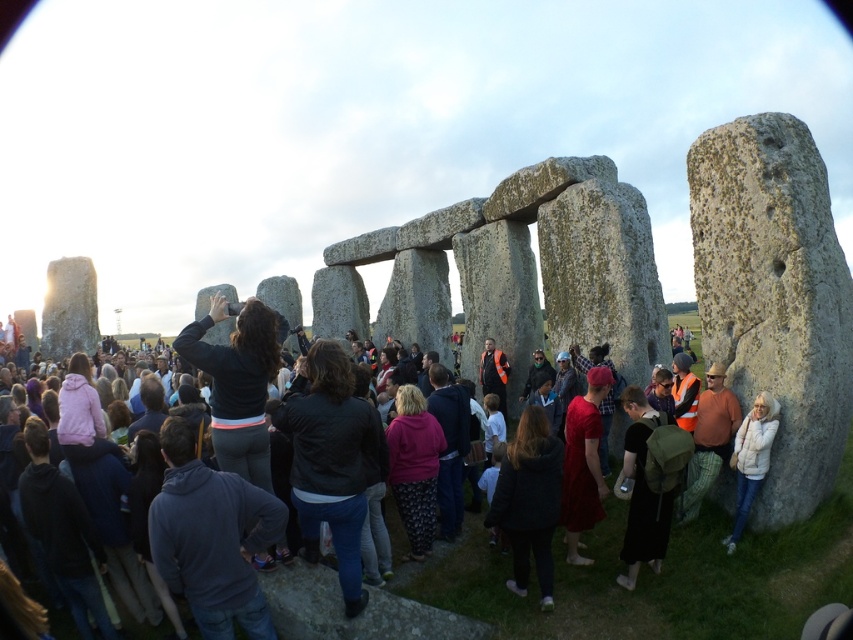
Question: Is dark gray stone at center smaller than white fleece jacket at right?

Choices:
 (A) no
 (B) yes

Answer: (A)

Question: Is dark gray stone at center above black fuzzy jacket at center?

Choices:
 (A) yes
 (B) no

Answer: (B)

Question: Which point is farther to the camera?

Choices:
 (A) black fuzzy jacket at center
 (B) white fleece jacket at right
 (C) black matte backpack at lower right
 (D) dark gray stone at center

Answer: (A)

Question: Which object is closer to the camera taking this photo?

Choices:
 (A) white fleece jacket at right
 (B) granite rock at center
 (C) dark gray stone at center

Answer: (C)

Question: Does dark gray stone at center lie in front of white fleece jacket at right?

Choices:
 (A) yes
 (B) no

Answer: (A)

Question: Estimate the real-world distances between objects in this image. Which object is farther from the dark gray stone at center?

Choices:
 (A) black fuzzy jacket at center
 (B) white fleece jacket at right
 (C) granite rock at center

Answer: (C)